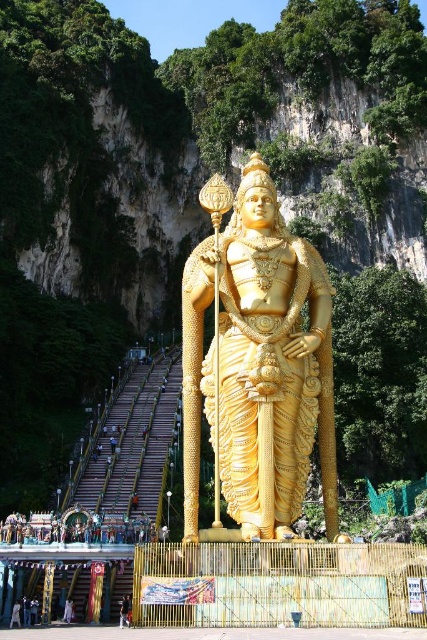
Question: Which object is closer to the camera taking this photo?

Choices:
 (A) light gray fabric person at lower left
 (B) golden polished statue at center
 (C) light brown fabric pants at lower left
 (D) dark blue jeans at lower center

Answer: (B)

Question: Estimate the real-world distances between objects in this image. Which object is farther from the dark blue jeans at lower center?

Choices:
 (A) light brown fabric pants at lower left
 (B) golden polished statue at center

Answer: (B)

Question: Which of these objects is positioned closest to the light gray fabric person at lower left?

Choices:
 (A) golden polished statue at center
 (B) dark blue jeans at lower center

Answer: (B)

Question: Considering the relative positions of light gray fabric person at lower left and light brown fabric pants at lower left in the image provided, where is light gray fabric person at lower left located with respect to light brown fabric pants at lower left?

Choices:
 (A) above
 (B) below

Answer: (A)

Question: Can you confirm if dark blue jeans at lower center is positioned below light brown fabric pants at lower left?

Choices:
 (A) yes
 (B) no

Answer: (B)

Question: Does dark blue jeans at lower center have a greater width compared to light brown fabric pants at lower left?

Choices:
 (A) yes
 (B) no

Answer: (A)